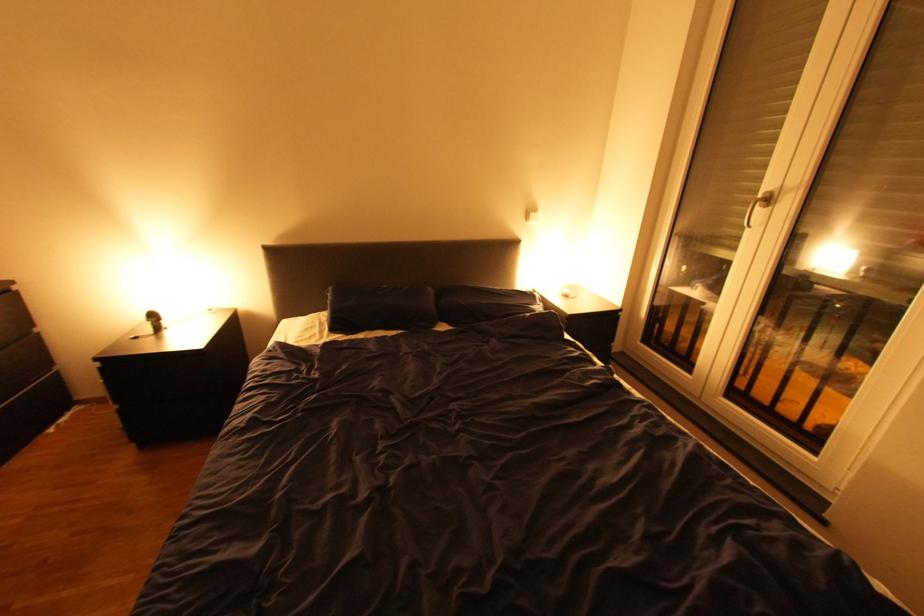
Find where to pull the window handle. Please return your answer as a coordinate pair (x, y).

(757, 206)